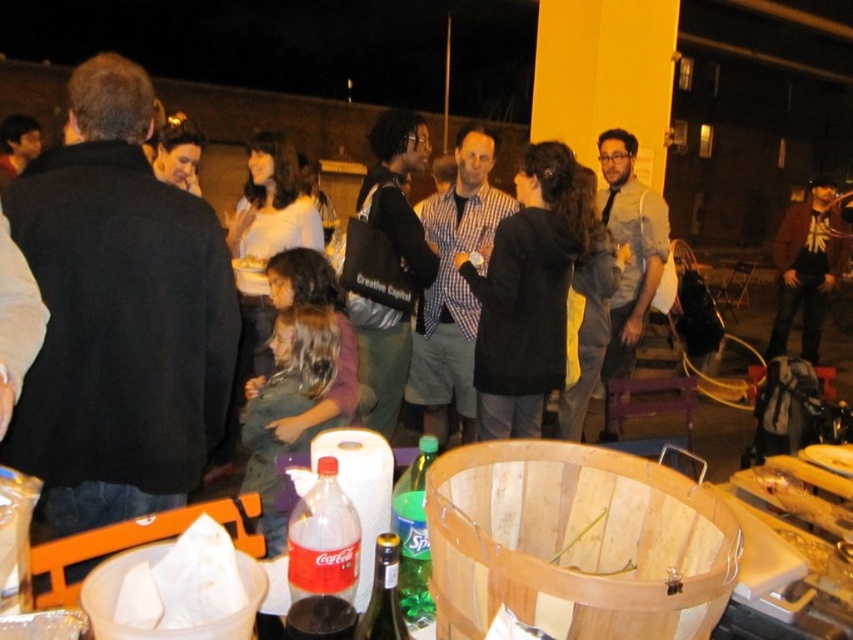
Is black matte coat at center to the right of translucent plastic coca-cola bottle at lower center from the viewer's perspective?

Indeed, black matte coat at center is positioned on the right side of translucent plastic coca-cola bottle at lower center.

Who is more distant from viewer, (518, 182) or (305, 561)?

Positioned behind is point (518, 182).

Describe the element at coordinates (527, 292) in the screenshot. This screenshot has width=853, height=640. I see `black matte coat at center` at that location.

Locate an element on the screen. black matte coat at center is located at coordinates (527, 292).

Where is `translucent plastic coca-cola bottle at lower center`? translucent plastic coca-cola bottle at lower center is located at coordinates (322, 560).

Who is more forward, (323, 490) or (386, 602)?

Positioned in front is point (386, 602).

Between point (326, 566) and point (358, 636), which one is positioned behind?

Point (326, 566)

The image size is (853, 640). Identify the location of translucent plastic coca-cola bottle at lower center. (322, 560).

Which is below, black matte coat at center or yellow paper bag at center?

black matte coat at center is lower down.

Is black matte coat at center wider than yellow paper bag at center?

Correct, the width of black matte coat at center exceeds that of yellow paper bag at center.

Does point (498, 420) lie in front of point (260, 262)?

Yes, it is.

The height and width of the screenshot is (640, 853). Find the location of `black matte coat at center`. black matte coat at center is located at coordinates tap(527, 292).